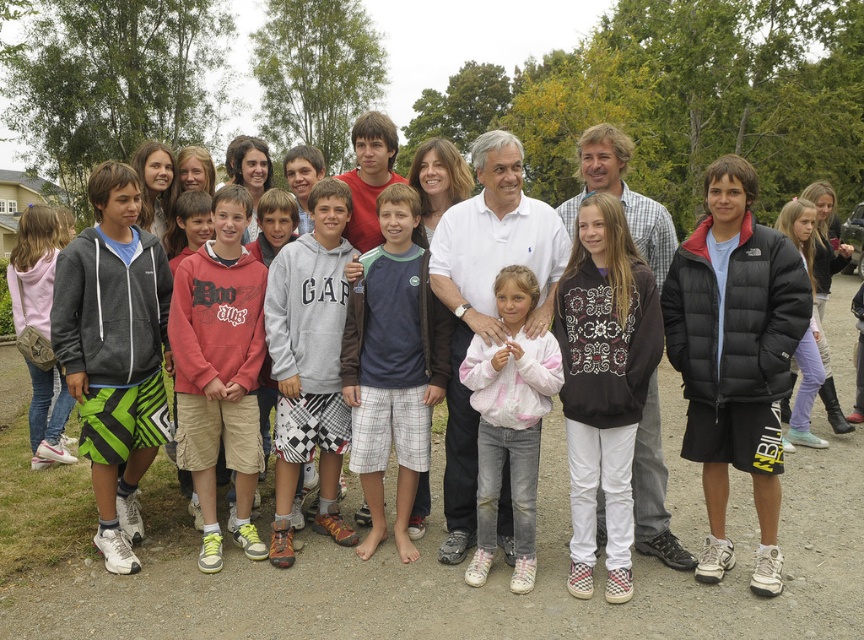
You are a photographer trying to adjust the focus of your camera. You want to ensure that both the green and black shorts at left and the white cotton jacket at center are clearly visible. Which object should you focus on first to ensure both are in focus?

The green and black shorts at left is positioned over the white cotton jacket at center, so focusing on the green and black shorts at left first will ensure both are in focus since it is closer to the camera.

You are organizing a clothing donation drive and need to determine which of the two items, the red hoodie at center or the dark blue cotton shirt at center, can fit into a standard donation box that requires items to be folded into a 12x12 inch square. Based on their sizes, which one is more likely to fit?

The dark blue cotton shirt at center is more likely to fit into the 12x12 inch donation box because the red hoodie at center has a larger size compared to it.